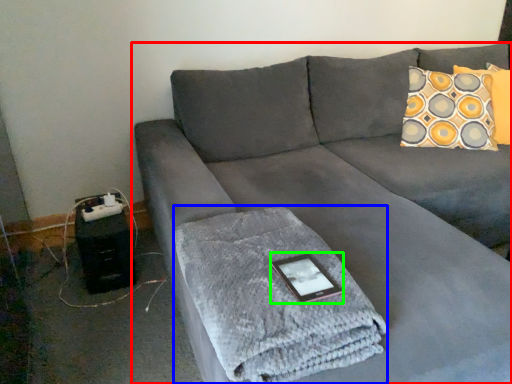
Question: Based on their relative distances, which object is nearer to studio couch (highlighted by a red box)? Choose from bath towel (highlighted by a blue box) and tablet computer (highlighted by a green box).

Choices:
 (A) bath towel
 (B) tablet computer

Answer: (A)